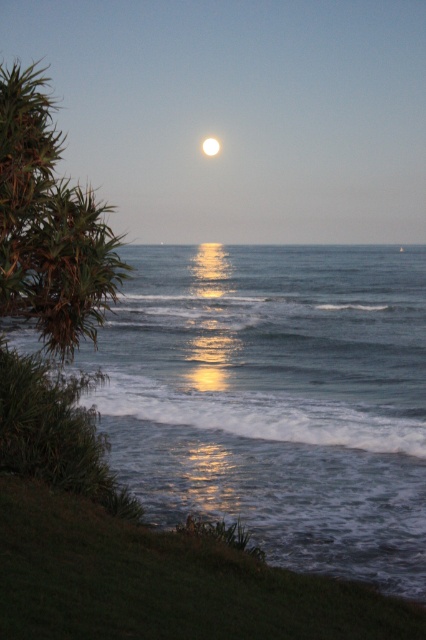
From the picture: You are an astronomer observing the coastal scene. You notice the smooth reflective water at center and the bright white sphere at center. Which object appears bigger in the image?

The smooth reflective water at center appears bigger than the bright white sphere at center in the image.

You are an astronomer observing the coastal scene. You notice the smooth reflective water at center and the bright white sphere at center. Which object is positioned lower in the image?

The smooth reflective water at center is positioned below the bright white sphere at center, so the smooth reflective water at center is lower in the image.

You are standing on the beach and want to walk towards the water. Which of the two waters, the glistening blue water at lower center or the smooth reflective water at center, do you think is closer to you?

The glistening blue water at lower center is closer to you because it is not as tall as the smooth reflective water at center, indicating it is nearer in the scene.